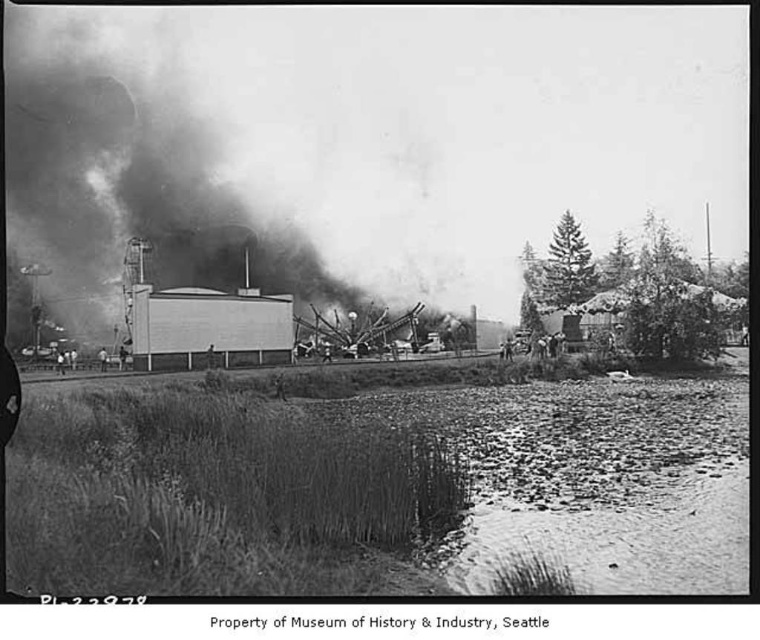
Question: Is black smoke at upper left to the right of smooth skin man at center from the viewer's perspective?

Choices:
 (A) no
 (B) yes

Answer: (A)

Question: Observing the image, what is the correct spatial positioning of black smoke at upper left in reference to smooth skin man at center?

Choices:
 (A) below
 (B) above

Answer: (B)

Question: Which of the following is the farthest from the observer?

Choices:
 (A) [149, 266]
 (B) [106, 355]

Answer: (A)

Question: Does black smoke at upper left appear under smooth skin man at center?

Choices:
 (A) no
 (B) yes

Answer: (A)